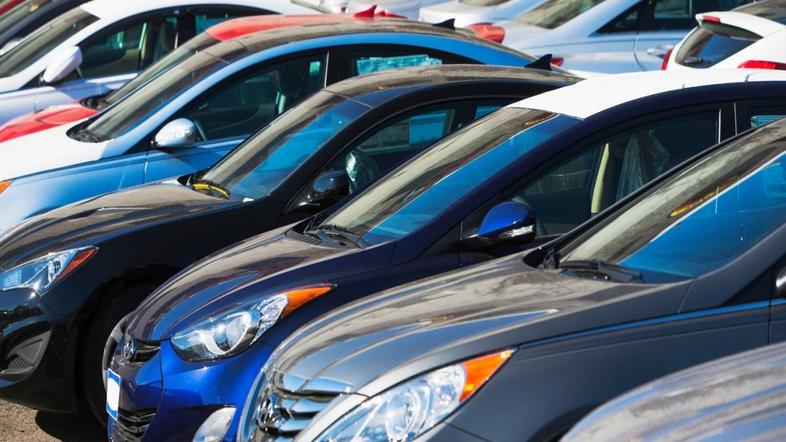
The height and width of the screenshot is (442, 786). What are the coordinates of `lights` in the screenshot? It's located at (406, 402), (259, 315), (48, 266), (4, 182), (754, 61), (665, 54), (555, 60), (494, 32), (390, 13), (362, 9).